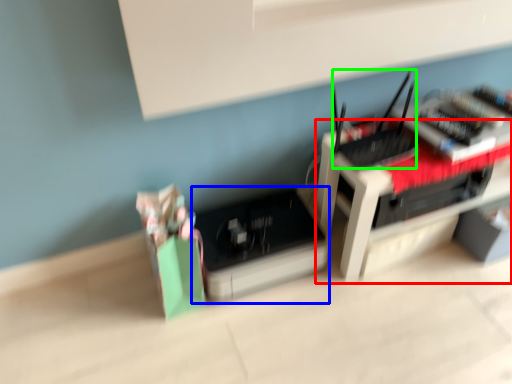
Question: Which object is the farthest from furniture (highlighted by a red box)? Choose among these: register (highlighted by a blue box) or register (highlighted by a green box).

Choices:
 (A) register
 (B) register

Answer: (A)